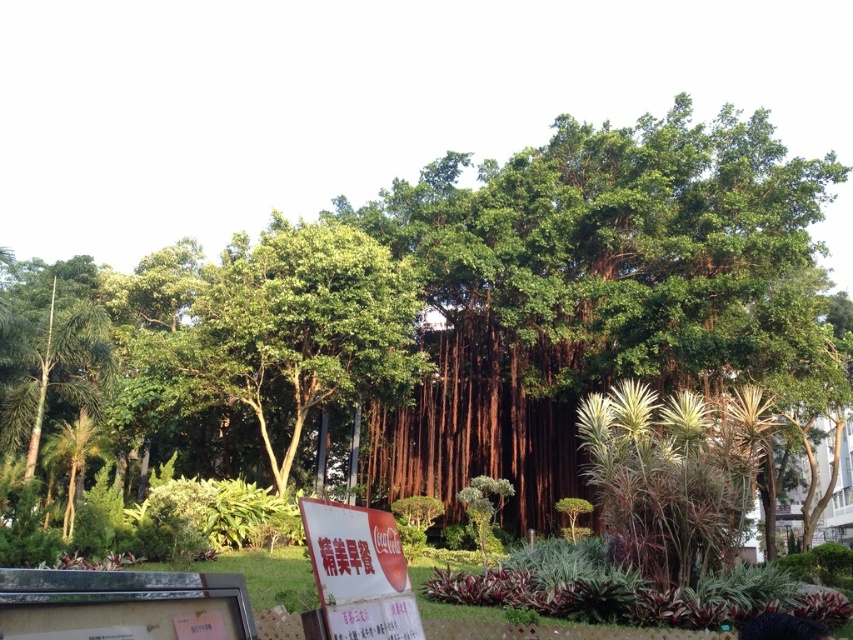
Question: Does green leafy banyan tree at center have a smaller size compared to white paper sign at lower center?

Choices:
 (A) no
 (B) yes

Answer: (A)

Question: Which point appears closest to the camera in this image?

Choices:
 (A) (347, 566)
 (B) (624, 365)

Answer: (A)

Question: Can you confirm if green leafy banyan tree at center is positioned to the left of white paper sign at lower center?

Choices:
 (A) yes
 (B) no

Answer: (B)

Question: Can you confirm if green leafy banyan tree at center is smaller than white paper sign at lower center?

Choices:
 (A) no
 (B) yes

Answer: (A)

Question: Which of the following is the closest to the observer?

Choices:
 (A) green leafy banyan tree at center
 (B) white paper sign at lower center

Answer: (B)

Question: Among these objects, which one is nearest to the camera?

Choices:
 (A) green leafy banyan tree at center
 (B) white paper sign at lower center

Answer: (B)